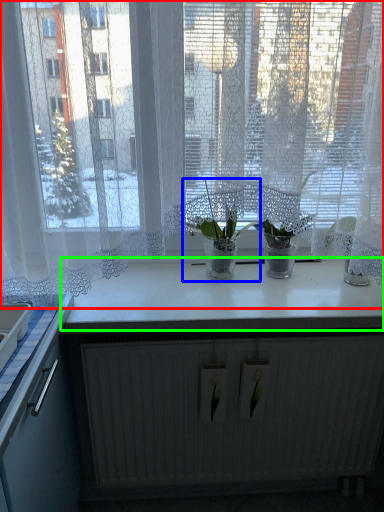
Question: Which object is positioned farthest from window (highlighted by a red box)? Select from houseplant (highlighted by a blue box) and counter top (highlighted by a green box).

Choices:
 (A) houseplant
 (B) counter top

Answer: (B)